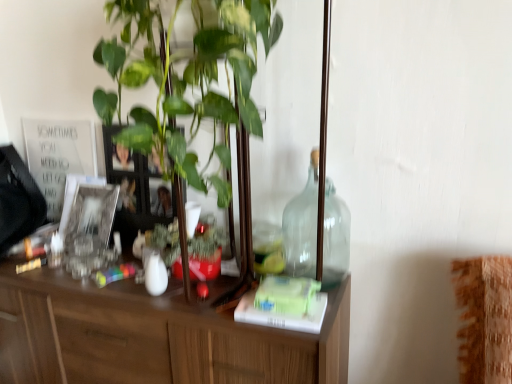
The width and height of the screenshot is (512, 384). What do you see at coordinates (302, 225) in the screenshot?
I see `transparent glass bottle at center-right` at bounding box center [302, 225].

Measure the distance between point [71,226] and camera.

Point [71,226] and camera are 4.64 feet apart from each other.

Identify the location of green matte book at center. Image resolution: width=512 pixels, height=384 pixels. (285, 304).

From the image's perspective, between transparent glass bottle at center-right and green matte book at center, which one is located above?

transparent glass bottle at center-right appears higher in the image.

Based on the photo, does transparent glass bottle at center-right turn towards green matte book at center?

Yes, transparent glass bottle at center-right is turned towards green matte book at center.

Is point (310, 179) positioned after point (305, 294)?

Yes, point (310, 179) is behind point (305, 294).

Considering the relative sizes of transparent glass bottle at center-right and green matte book at center in the image provided, is transparent glass bottle at center-right shorter than green matte book at center?

No, transparent glass bottle at center-right is not shorter than green matte book at center.

Can you confirm if transparent glass bottle at center-right is positioned to the right of silver metallic picture frame at left?

Correct, you'll find transparent glass bottle at center-right to the right of silver metallic picture frame at left.

Consider the image. Is transparent glass bottle at center-right wider than silver metallic picture frame at left?

Yes.

From the picture: Could you measure the distance between transparent glass bottle at center-right and silver metallic picture frame at left?

A distance of 24.82 inches exists between transparent glass bottle at center-right and silver metallic picture frame at left.

From the image's perspective, which object appears higher, transparent glass bottle at center-right or silver metallic picture frame at left?

transparent glass bottle at center-right, from the image's perspective.

Which of these two, green matte book at center or transparent glass bottle at center-right, is bigger?

transparent glass bottle at center-right is bigger.

Which is more to the left, green matte book at center or transparent glass bottle at center-right?

Positioned to the left is green matte book at center.

Is green matte book at center touching transparent glass bottle at center-right?

green matte book at center and transparent glass bottle at center-right are clearly separated.

Is white glossy vase at center surrounding silver metallic picture frame at left?

Definitely not — silver metallic picture frame at left is not inside white glossy vase at center.

Between point (158, 270) and point (77, 196), which one is positioned in front?

The point (158, 270) is closer.

The height and width of the screenshot is (384, 512). I want to click on vase beneath the silver metallic picture frame at left (from a real-world perspective), so click(x=154, y=272).

How far apart are white glossy vase at center and silver metallic picture frame at left?

A distance of 10.50 inches exists between white glossy vase at center and silver metallic picture frame at left.

How much distance is there between transparent glass bottle at center-right and white glossy vase at center?

transparent glass bottle at center-right is 17.00 inches away from white glossy vase at center.

Is transparent glass bottle at center-right located outside white glossy vase at center?

transparent glass bottle at center-right is positioned outside white glossy vase at center.

Does transparent glass bottle at center-right have a larger size compared to white glossy vase at center?

Yes, transparent glass bottle at center-right is bigger than white glossy vase at center.

Are transparent glass bottle at center-right and white glossy vase at center making contact?

transparent glass bottle at center-right is not next to white glossy vase at center, and they're not touching.

Could you tell me if green matte book at center is facing silver metallic picture frame at left?

No, green matte book at center is not facing towards silver metallic picture frame at left.

Is green matte book at center positioned behind silver metallic picture frame at left?

No, it is in front of silver metallic picture frame at left.

In the scene shown: Which of these two, green matte book at center or silver metallic picture frame at left, is smaller?

With smaller size is green matte book at center.

From the image's perspective, between green matte book at center and silver metallic picture frame at left, which one is located above?

From the image's view, silver metallic picture frame at left is above.

Is silver metallic picture frame at left shorter than green matte book at center?

No.

Considering the relative sizes of silver metallic picture frame at left and green matte book at center in the image provided, is silver metallic picture frame at left wider than green matte book at center?

No, silver metallic picture frame at left is not wider than green matte book at center.

In the scene shown: Is silver metallic picture frame at left beside green matte book at center?

No, silver metallic picture frame at left is not in contact with green matte book at center.

Is point (118, 190) positioned after point (313, 300)?

Yes, it is.

In the image, there is a green matte book at center. Where is `bottle above it (from the image's perspective)`? The height and width of the screenshot is (384, 512). bottle above it (from the image's perspective) is located at coordinates (302, 225).

Identify the location of picture frame behind the transparent glass bottle at center-right. This screenshot has height=384, width=512. (89, 228).

From the picture: Considering their positions, is silver metallic picture frame at left positioned further to white glossy vase at center than transparent glass bottle at center-right?

The object further to white glossy vase at center is transparent glass bottle at center-right.

Considering their positions, is green matte book at center positioned further to silver metallic picture frame at left than white glossy vase at center?

Based on the image, green matte book at center appears to be further to silver metallic picture frame at left.

Estimate the real-world distances between objects in this image. Which object is closer to green matte book at center, transparent glass bottle at center-right or silver metallic picture frame at left?

transparent glass bottle at center-right lies closer to green matte book at center than the other object.

Looking at the image, which one is located closer to transparent glass bottle at center-right, green matte book at center or white glossy vase at center?

green matte book at center is positioned closer to the anchor transparent glass bottle at center-right.

Considering their positions, is green matte book at center positioned closer to white glossy vase at center than transparent glass bottle at center-right?

green matte book at center is positioned closer to the anchor white glossy vase at center.

Looking at the image, which one is located closer to silver metallic picture frame at left, white glossy vase at center or green matte book at center?

white glossy vase at center lies closer to silver metallic picture frame at left than the other object.

Looking at the image, which one is located further to transparent glass bottle at center-right, silver metallic picture frame at left or green matte book at center?

silver metallic picture frame at left.

Looking at the image, which one is located further to transparent glass bottle at center-right, green matte book at center or silver metallic picture frame at left?

Among the two, silver metallic picture frame at left is located further to transparent glass bottle at center-right.

At what (x,y) coordinates should I click in order to perform the action: click on vase situated between silver metallic picture frame at left and transparent glass bottle at center-right from left to right. Please return your answer as a coordinate pair (x, y). The height and width of the screenshot is (384, 512). Looking at the image, I should click on (154, 272).

Find the location of a particular element. This screenshot has width=512, height=384. vase between silver metallic picture frame at left and green matte book at center from left to right is located at coordinates (154, 272).

Find the location of `book between white glossy vase at center and transparent glass bottle at center-right from left to right`. book between white glossy vase at center and transparent glass bottle at center-right from left to right is located at coordinates (285, 304).

This screenshot has width=512, height=384. In order to click on book situated between silver metallic picture frame at left and transparent glass bottle at center-right from left to right in this screenshot , I will do `click(285, 304)`.